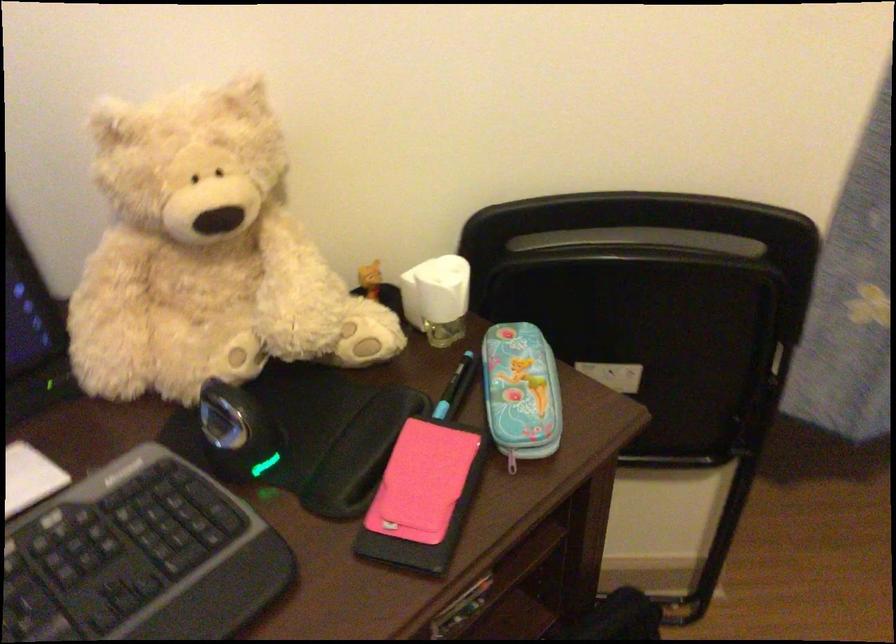
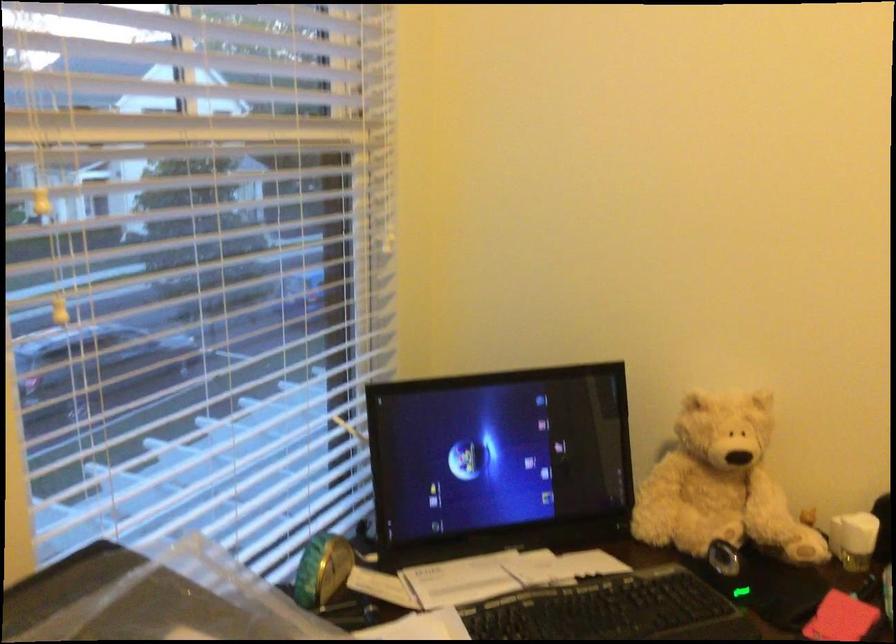
Where in the second image is the point corresponding to (x=426, y=478) from the first image?

(840, 618)